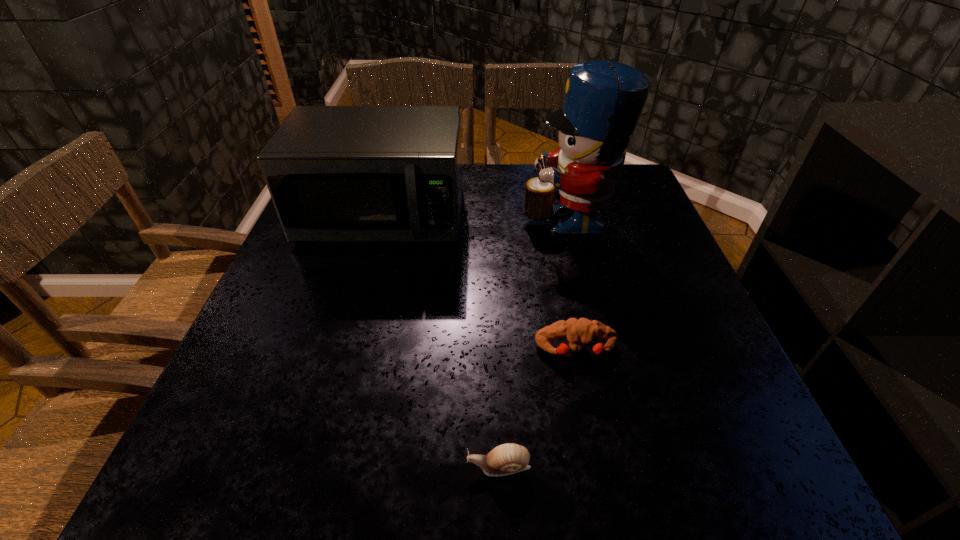
The width and height of the screenshot is (960, 540). In order to click on empty space between the escargot and the tallest object in this screenshot , I will do `click(533, 341)`.

The width and height of the screenshot is (960, 540). Find the location of `empty space that is in between the puncher and the tallest object`. empty space that is in between the puncher and the tallest object is located at coordinates (571, 283).

Identify the location of vacant region between the nutcracker and the nearest object. (533, 341).

Locate an element on the screen. The width and height of the screenshot is (960, 540). vacant space in between the third object from right to left and the nutcracker is located at coordinates (533, 341).

Where is `unoccupied position between the nutcracker and the puncher`? Image resolution: width=960 pixels, height=540 pixels. unoccupied position between the nutcracker and the puncher is located at coordinates (571, 283).

This screenshot has height=540, width=960. Find the location of `empty space that is in between the puncher and the tallest object`. empty space that is in between the puncher and the tallest object is located at coordinates (571, 283).

Where is `free space between the third shortest object and the puncher`? free space between the third shortest object and the puncher is located at coordinates (479, 284).

Select which object appears as the closest to the second tallest object. Please provide its 2D coordinates. Your answer should be formatted as a tuple, i.e. [(x, y)], where the tuple contains the x and y coordinates of a point satisfying the conditions above.

[(603, 101)]

At what (x,y) coordinates should I click in order to perform the action: click on object that is the nearest to the second object from left to right. Please return your answer as a coordinate pair (x, y). Image resolution: width=960 pixels, height=540 pixels. Looking at the image, I should click on (578, 332).

Find the location of a particular element. The image size is (960, 540). free space that satisfies the following two spatial constraints: 1. on the front-facing side of the tallest object; 2. with the gloves of the second nearest object facing forward is located at coordinates (600, 349).